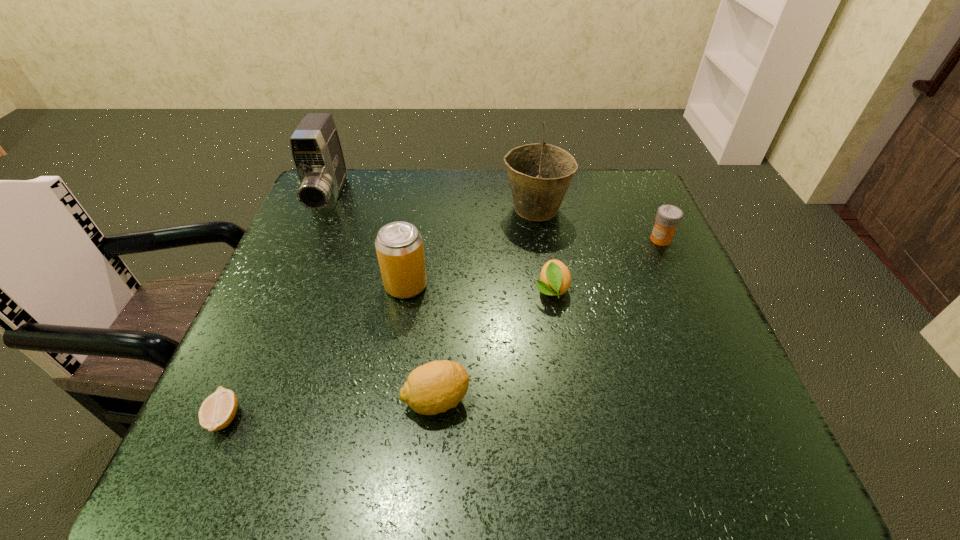
At what (x,y) coordinates should I click in order to perform the action: click on wine bucket. Please return your answer as a coordinate pair (x, y). Looking at the image, I should click on (540, 174).

Locate an element on the screen. camcorder is located at coordinates (316, 150).

I want to click on the third tallest object, so click(399, 245).

The image size is (960, 540). What are the coordinates of `the rightmost object` in the screenshot? It's located at (668, 217).

Where is `medicine`? The height and width of the screenshot is (540, 960). medicine is located at coordinates (668, 217).

Locate an element on the screen. The image size is (960, 540). the second lemon from right to left is located at coordinates (435, 387).

You are a GUI agent. You are given a task and a screenshot of the screen. Output one action in this format:
    pyautogui.click(x=<x>, y=<y>)
    Task: Click on the sixth tallest object
    
    Given the screenshot: What is the action you would take?
    pyautogui.click(x=555, y=279)

You are a GUI agent. You are given a task and a screenshot of the screen. Output one action in this format:
    pyautogui.click(x=<x>, y=<y>)
    Task: Click on the rightmost lemon
    This screenshot has height=540, width=960.
    Given the screenshot: What is the action you would take?
    pyautogui.click(x=555, y=279)

Identify the location of the shortest object. The height and width of the screenshot is (540, 960). (218, 410).

At what (x,y) coordinates should I click in order to perform the action: click on the shortest lemon. Please return your answer as a coordinate pair (x, y). This screenshot has height=540, width=960. Looking at the image, I should click on (218, 410).